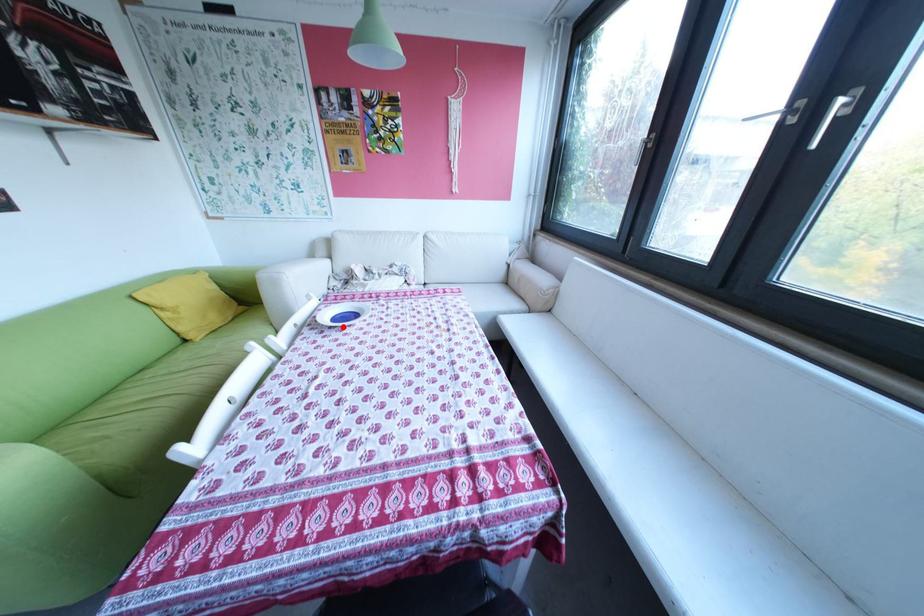
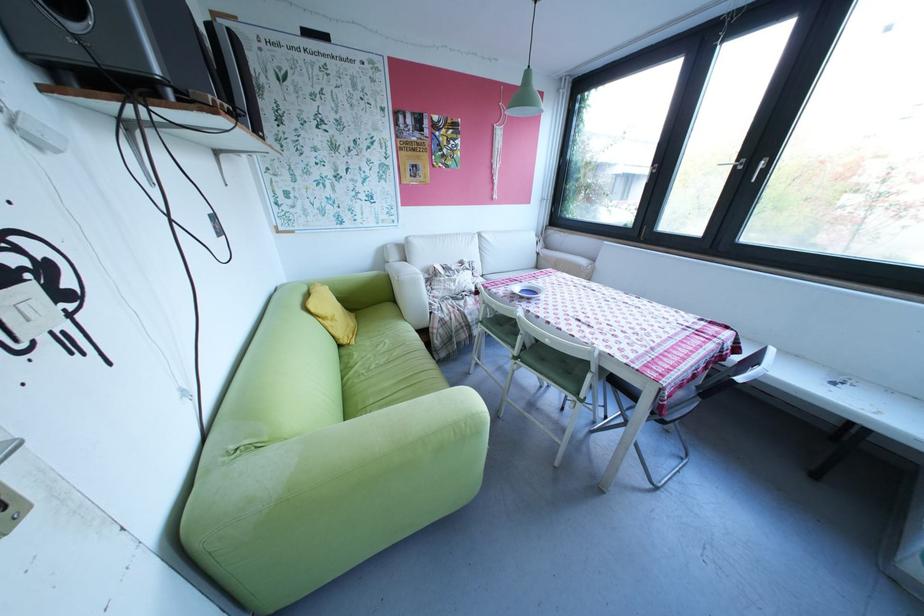
The point at the highlighted location is marked in the first image. Where is the corresponding point in the second image?

(541, 299)